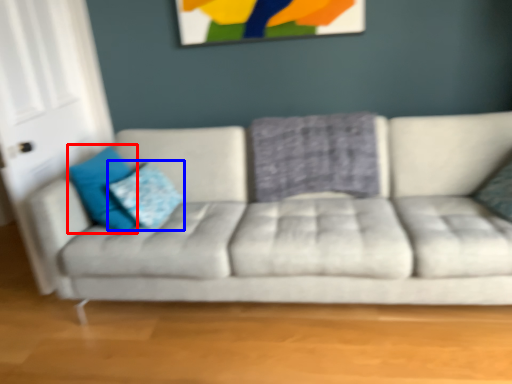
Question: Which point is further to the camera, pillow (highlighted by a red box) or pillow (highlighted by a blue box)?

Choices:
 (A) pillow
 (B) pillow

Answer: (B)